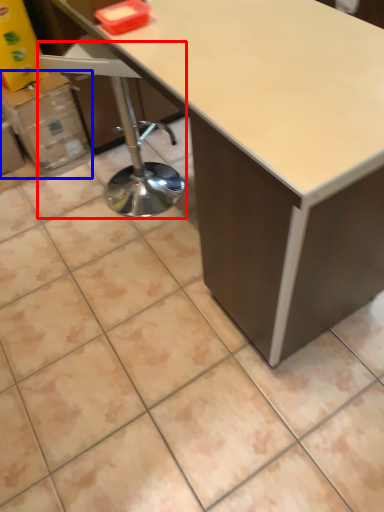
Question: Which of the following is the closest to the observer, swivel chair (highlighted by a red box) or cardboard box (highlighted by a blue box)?

Choices:
 (A) swivel chair
 (B) cardboard box

Answer: (A)